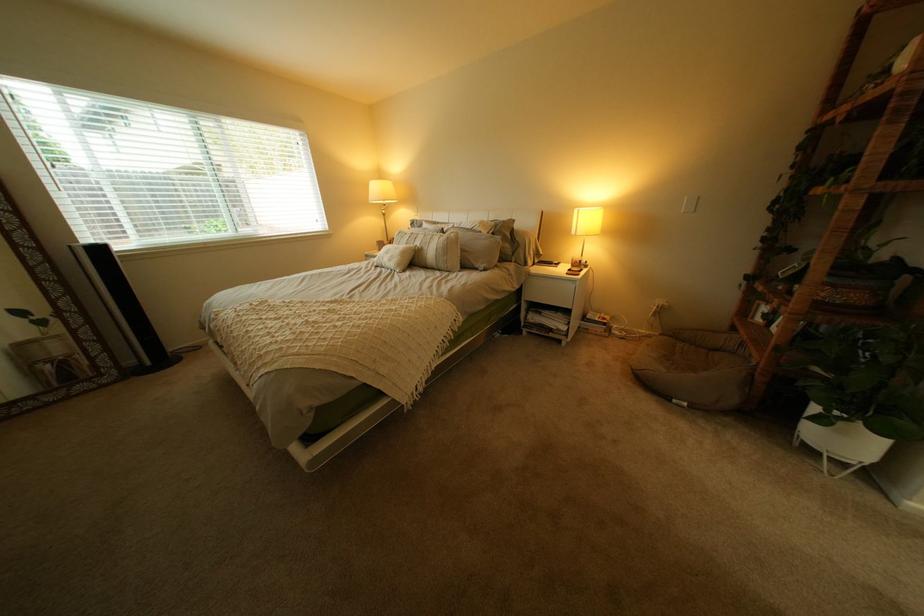
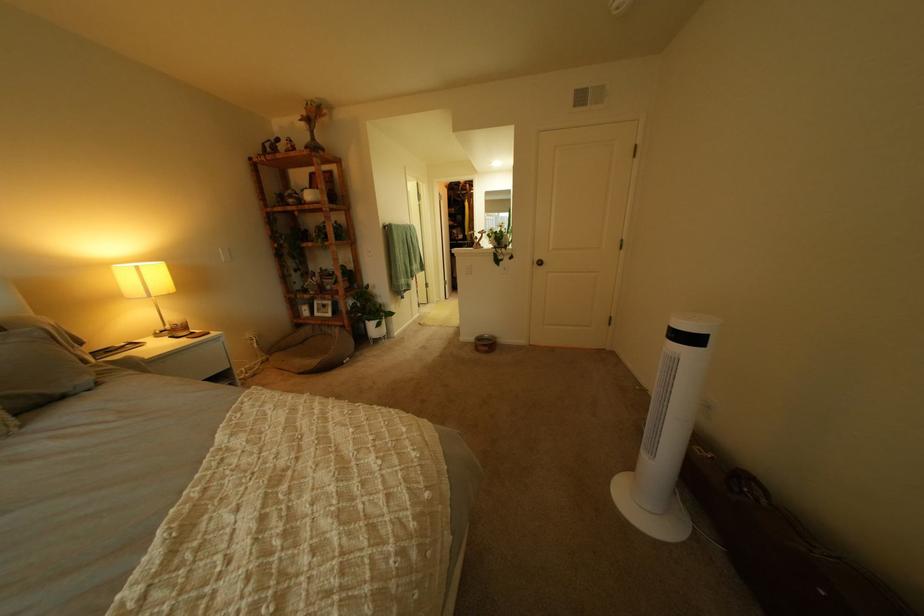
In the second image, find the point that corresponds to (501,270) in the first image.

(115, 385)